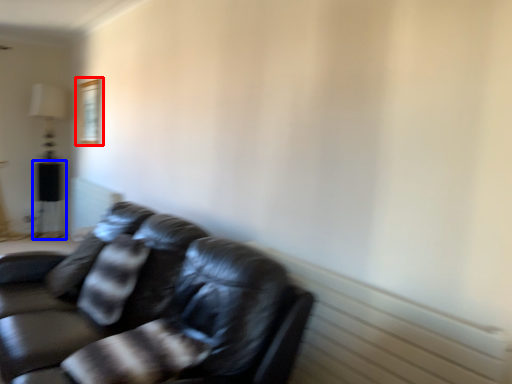
Question: Which point is closer to the camera, picture frame (highlighted by a red box) or table (highlighted by a blue box)?

Choices:
 (A) picture frame
 (B) table

Answer: (A)